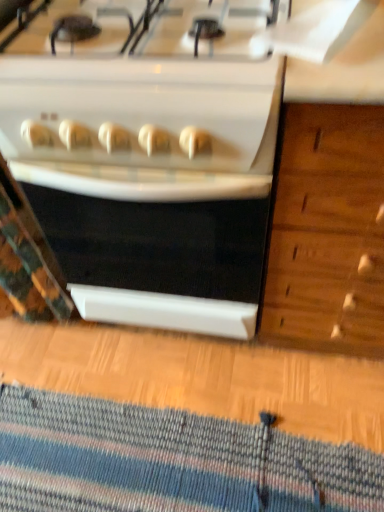
Describe the element at coordinates (150, 177) in the screenshot. This screenshot has width=384, height=512. I see `white glossy stove at center` at that location.

Locate an element on the screen. Image resolution: width=384 pixels, height=512 pixels. white glossy stove at center is located at coordinates (150, 177).

Describe the element at coordinates (168, 461) in the screenshot. I see `striped wool doormat at lower center` at that location.

The height and width of the screenshot is (512, 384). I want to click on striped wool doormat at lower center, so click(x=168, y=461).

Measure the distance between striped wool doormat at lower center and camera.

striped wool doormat at lower center and camera are 39.19 inches apart from each other.

I want to click on white glossy stove at center, so click(150, 177).

Which object is positioned more to the left, striped wool doormat at lower center or white glossy stove at center?

From the viewer's perspective, striped wool doormat at lower center appears more on the left side.

Is striped wool doormat at lower center further to camera compared to white glossy stove at center?

Yes, it is.

Is point (339, 503) less distant than point (66, 135)?

No, (339, 503) is further to viewer.

From the image's perspective, relative to white glossy stove at center, is striped wool doormat at lower center above or below?

striped wool doormat at lower center is situated lower than white glossy stove at center in the image.

From a real-world perspective, which is physically above, striped wool doormat at lower center or white glossy stove at center?

white glossy stove at center is physically above.

Looking at this image, which of these two, striped wool doormat at lower center or white glossy stove at center, is thinner?

striped wool doormat at lower center is thinner.

Can you confirm if striped wool doormat at lower center is taller than white glossy stove at center?

In fact, striped wool doormat at lower center may be shorter than white glossy stove at center.

Who is bigger, striped wool doormat at lower center or white glossy stove at center?

With larger size is white glossy stove at center.

Is white glossy stove at center located within striped wool doormat at lower center?

No.

Would you say striped wool doormat at lower center is a long distance from white glossy stove at center?

striped wool doormat at lower center is near white glossy stove at center, not far away.

Is white glossy stove at center at the back of striped wool doormat at lower center?

striped wool doormat at lower center is not turned away from white glossy stove at center.

The height and width of the screenshot is (512, 384). I want to click on doormat below the white glossy stove at center (from a real-world perspective), so click(168, 461).

Which is more to the left, white glossy stove at center or striped wool doormat at lower center?

Positioned to the left is striped wool doormat at lower center.

Considering their positions, is white glossy stove at center located in front of or behind striped wool doormat at lower center?

white glossy stove at center is in front of striped wool doormat at lower center.

Is point (200, 49) behind point (152, 511)?

No, (200, 49) is closer to viewer.

From the image's perspective, does white glossy stove at center appear higher than striped wool doormat at lower center?

Yes, from the image's perspective, white glossy stove at center is above striped wool doormat at lower center.

From a real-world perspective, is white glossy stove at center positioned above or below striped wool doormat at lower center?

Clearly, from a real-world perspective, white glossy stove at center is above striped wool doormat at lower center.

In terms of width, does white glossy stove at center look wider or thinner when compared to striped wool doormat at lower center?

In the image, white glossy stove at center appears to be wider than striped wool doormat at lower center.

Considering the relative sizes of white glossy stove at center and striped wool doormat at lower center in the image provided, is white glossy stove at center shorter than striped wool doormat at lower center?

No.

Is white glossy stove at center bigger or smaller than striped wool doormat at lower center?

Considering their sizes, white glossy stove at center takes up more space than striped wool doormat at lower center.

In the scene shown: Can striped wool doormat at lower center be found inside white glossy stove at center?

No.

Is white glossy stove at center not close to striped wool doormat at lower center?

No.

Is white glossy stove at center facing away from striped wool doormat at lower center?

No, striped wool doormat at lower center is not at the back of white glossy stove at center.

I want to click on kitchen appliance on the right of striped wool doormat at lower center, so click(x=150, y=177).

At what (x,y) coordinates should I click in order to perform the action: click on doormat that is behind the white glossy stove at center. Please return your answer as a coordinate pair (x, y). Looking at the image, I should click on (168, 461).

At what (x,y) coordinates should I click in order to perform the action: click on doormat on the left side of white glossy stove at center. Please return your answer as a coordinate pair (x, y). The image size is (384, 512). Looking at the image, I should click on [168, 461].